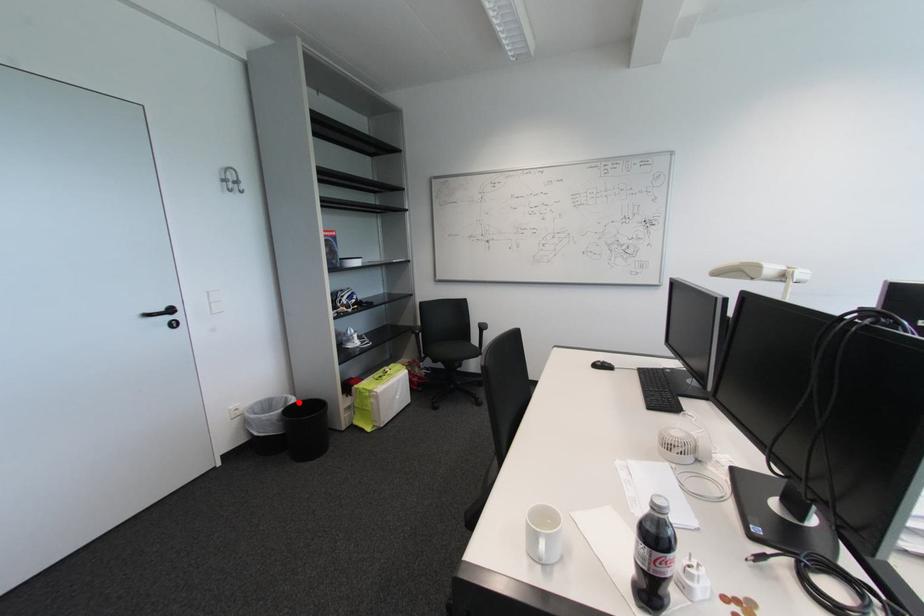
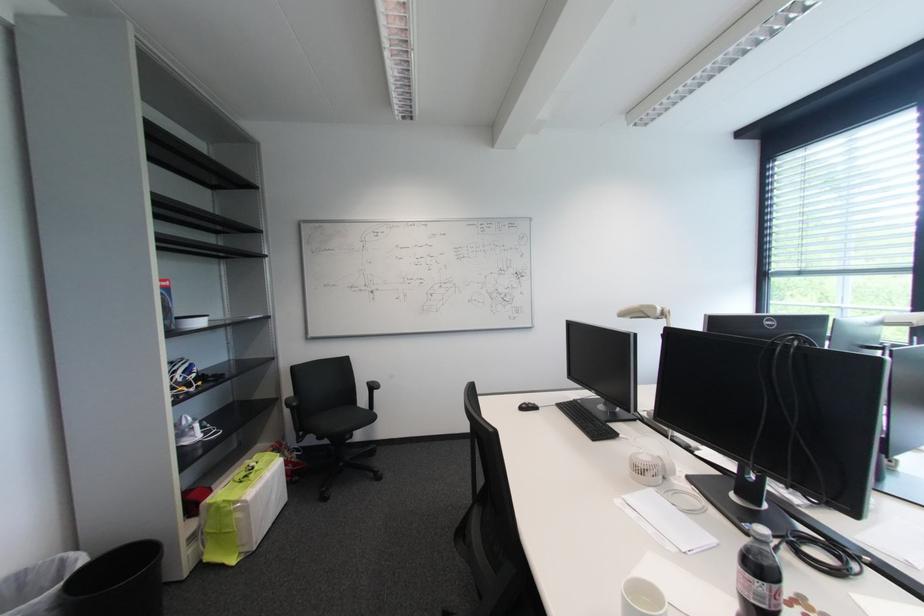
Question: I am providing you with two images of the same scene from different viewpoints. Given a red point in image1, look at the same physical point in image2. Is it:

Choices:
 (A) Closer to the viewpoint
 (B) Farther from the viewpoint

Answer: (A)